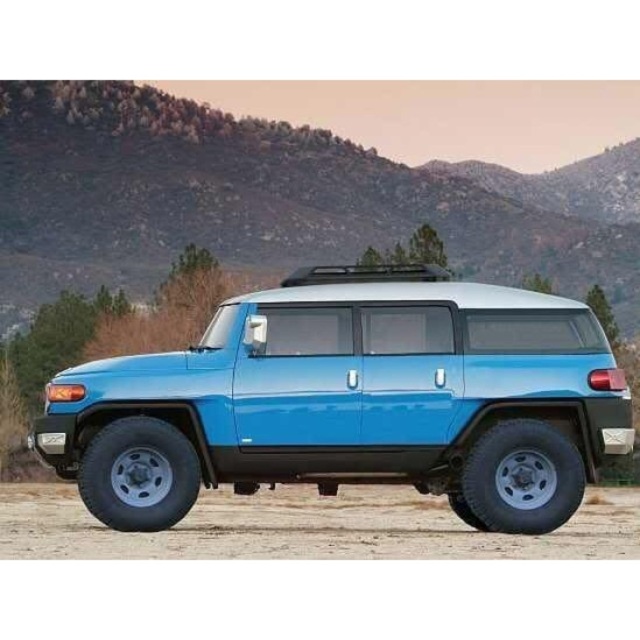
Between matte blue suv at center and dirt field at lower center, which one is positioned lower?

Positioned lower is dirt field at lower center.

Measure the distance from matte blue suv at center to dirt field at lower center.

The distance of matte blue suv at center from dirt field at lower center is 9.70 feet.

Who is more forward, (112, 486) or (120, 541)?

Point (120, 541)

At what (x,y) coordinates should I click in order to perform the action: click on matte blue suv at center. Please return your answer as a coordinate pair (x, y). Looking at the image, I should click on (353, 401).